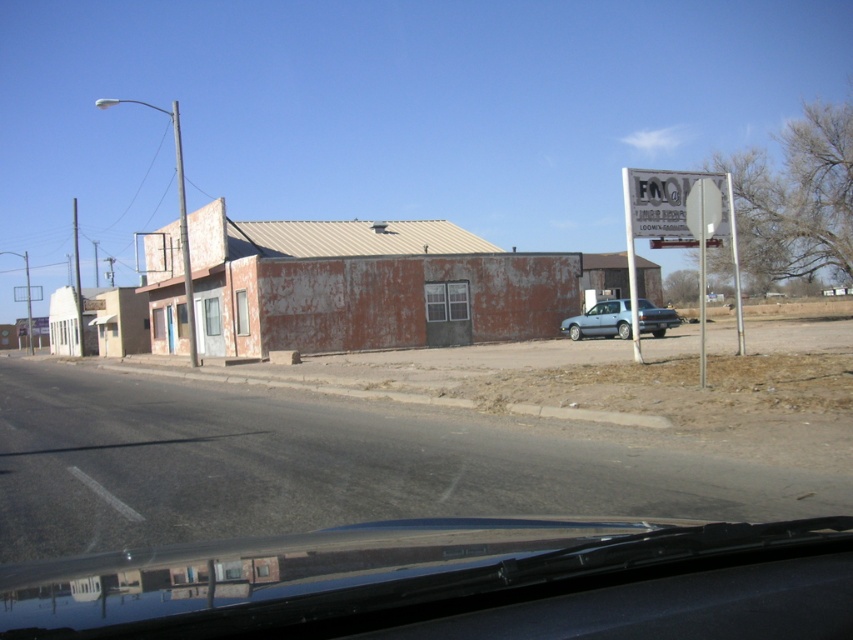
Does transparent glass windshield at center have a smaller size compared to satin silver sedan at center?

Correct, transparent glass windshield at center occupies less space than satin silver sedan at center.

Can you confirm if transparent glass windshield at center is taller than satin silver sedan at center?

Incorrect, transparent glass windshield at center's height is not larger of satin silver sedan at center's.

At what (x,y) coordinates should I click in order to perform the action: click on transparent glass windshield at center. Please return your answer as a coordinate pair (x, y). Image resolution: width=853 pixels, height=640 pixels. Looking at the image, I should click on (456, 582).

The height and width of the screenshot is (640, 853). I want to click on transparent glass windshield at center, so click(456, 582).

Is white plastic sign at right to the right of satin silver sedan at center from the viewer's perspective?

Indeed, white plastic sign at right is positioned on the right side of satin silver sedan at center.

Does point (675, 209) come closer to viewer compared to point (595, 316)?

Yes.

Which is behind, point (631, 275) or point (648, 326)?

Point (648, 326)

The width and height of the screenshot is (853, 640). In order to click on white plastic sign at right in this screenshot , I will do `click(682, 224)`.

Which is in front, point (498, 598) or point (672, 186)?

Point (498, 598) is more forward.

Is point (619, 580) positioned after point (659, 234)?

No.

Describe the element at coordinates (456, 582) in the screenshot. I see `transparent glass windshield at center` at that location.

Locate an element on the screen. transparent glass windshield at center is located at coordinates 456,582.